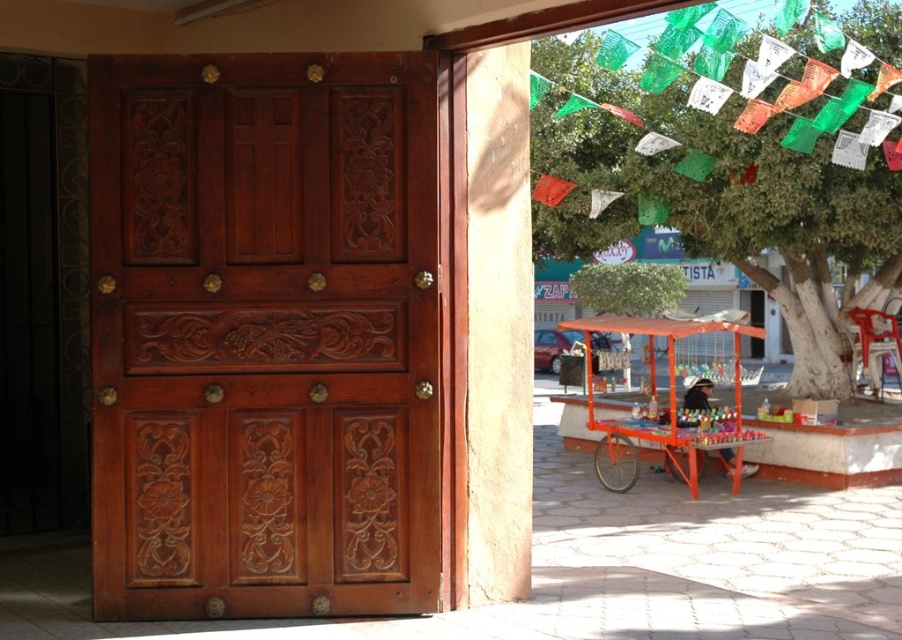
Question: Based on their relative distances, which object is nearer to the polished wood door at left?

Choices:
 (A) green leafy tree at upper right
 (B) orange metallic cart at center

Answer: (B)

Question: Based on their relative distances, which object is nearer to the polished wood door at left?

Choices:
 (A) green leafy tree at upper right
 (B) orange metallic cart at center

Answer: (B)

Question: Does polished wood door at left appear under green leafy tree at upper right?

Choices:
 (A) yes
 (B) no

Answer: (A)

Question: Is polished wood door at left above green leafy tree at upper right?

Choices:
 (A) yes
 (B) no

Answer: (B)

Question: Among these objects, which one is nearest to the camera?

Choices:
 (A) orange metallic cart at center
 (B) green leafy tree at upper right

Answer: (A)

Question: Is green leafy tree at upper right to the right of orange metallic cart at center from the viewer's perspective?

Choices:
 (A) no
 (B) yes

Answer: (B)